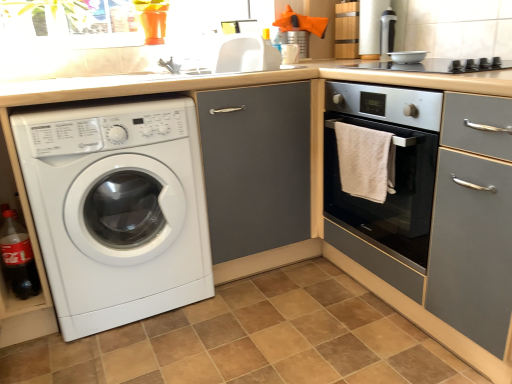
Question: Is translucent plastic bottle at lower left wider or thinner than matte gray cabinet at center?

Choices:
 (A) thin
 (B) wide

Answer: (A)

Question: Is translucent plastic bottle at lower left taller or shorter than matte gray cabinet at center?

Choices:
 (A) short
 (B) tall

Answer: (A)

Question: Based on their relative distances, which object is nearer to the matte gray cabinet at center?

Choices:
 (A) satin grey oven at center right
 (B) white glossy sink at upper center
 (C) brown tile at lower center
 (D) white glossy washing machine at lower left
 (E) translucent plastic bottle at lower left

Answer: (D)

Question: Which object is the farthest from the white glossy sink at upper center?

Choices:
 (A) metallic silver canister at upper right, acting as the second appliance starting from the bottom
 (B) white glossy washing machine at lower left
 (C) matte gray cabinet at center
 (D) translucent plastic bottle at lower left
 (E) brown tile at lower center

Answer: (E)